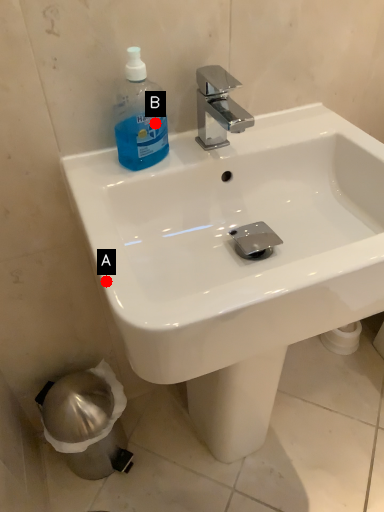
Question: Two points are circled on the image, labeled by A and B beside each circle. Which point appears farthest from the camera in this image?

Choices:
 (A) A is further
 (B) B is further

Answer: (B)